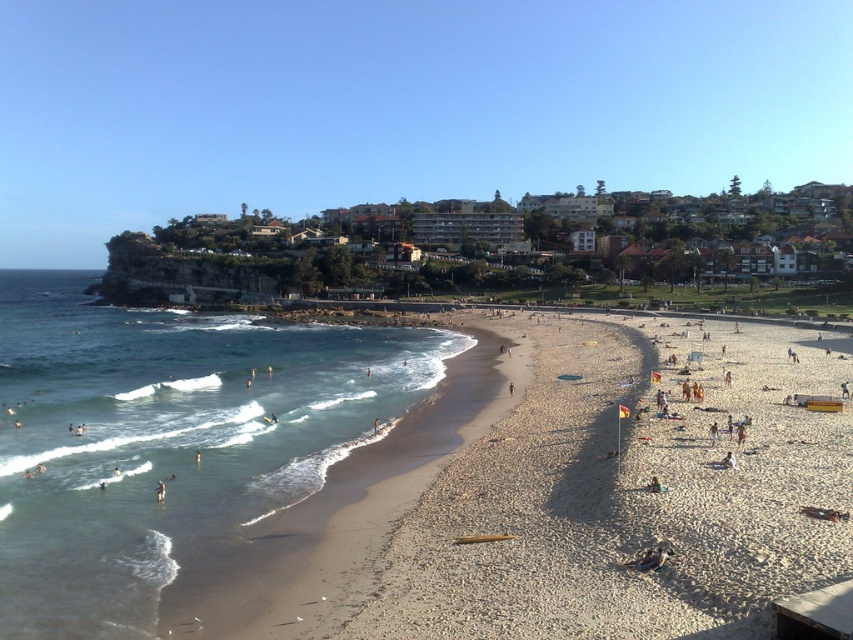
You are standing on the beach in the image and see the point marked at coordinates (650, 560). What object is this point located on?

The point at coordinates (650, 560) is located on the dark brown leather bag at lower center.

You are standing on the beach and see two points marked on the image. The first point is at coordinate point[656,483] and the second is at point[158,499]. Which point is closer to you?

Point[656,483] is closer to the viewer than point[158,499].

You are a beachgoer who just arrived and wants to place your dark brown leather bag at lower center on the sand. However, you notice light brown gravel at center nearby. Where should you place your bag to avoid the gravel?

You should place the dark brown leather bag at lower center to the left side of the light brown gravel at center to avoid the gravel.